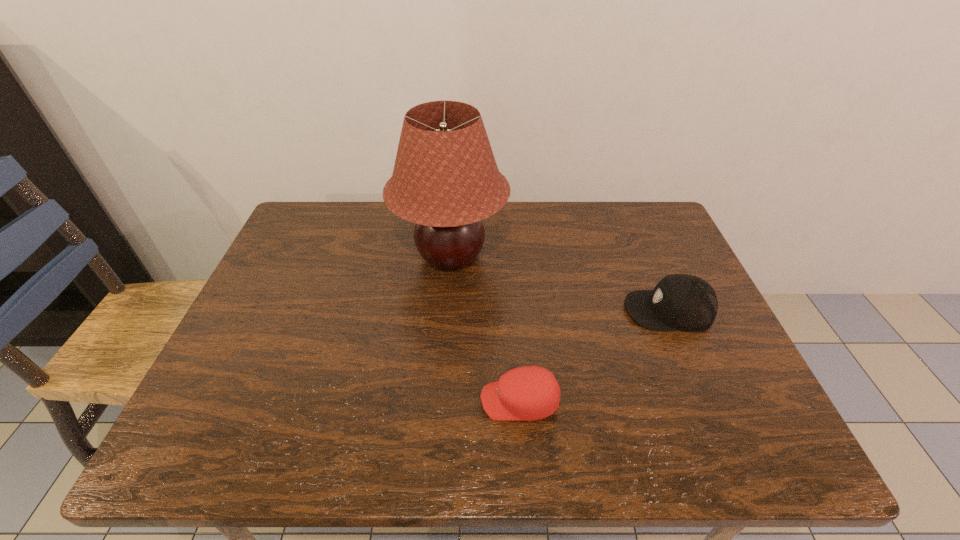
Image resolution: width=960 pixels, height=540 pixels. I want to click on empty location between the nearest object and the farther cap, so (x=594, y=355).

Where is `empty location between the right cap and the tallest object`? empty location between the right cap and the tallest object is located at coordinates (560, 283).

Where is `the second closest object to the lampshade`? the second closest object to the lampshade is located at coordinates (684, 302).

Where is `object that is the closest to the left cap`? Image resolution: width=960 pixels, height=540 pixels. object that is the closest to the left cap is located at coordinates (684, 302).